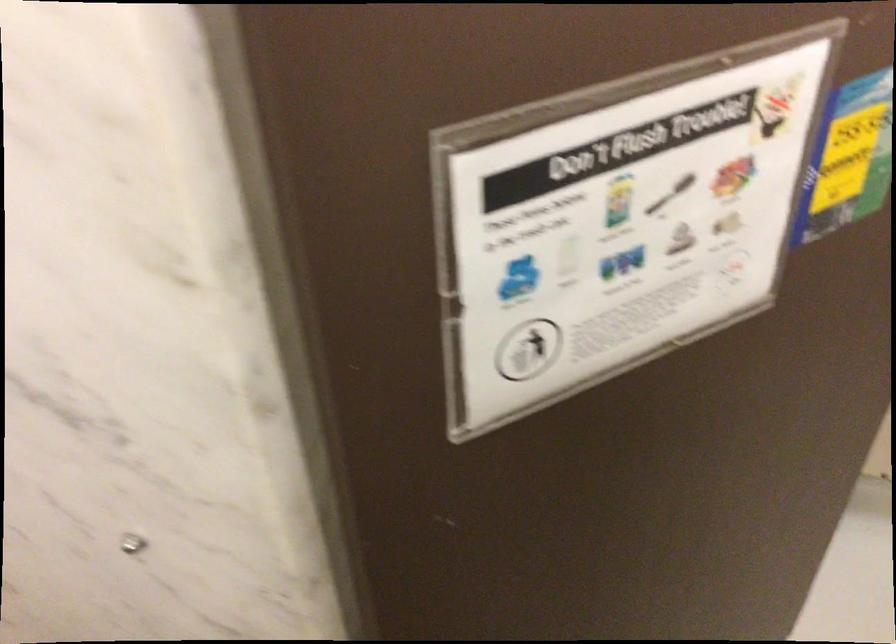
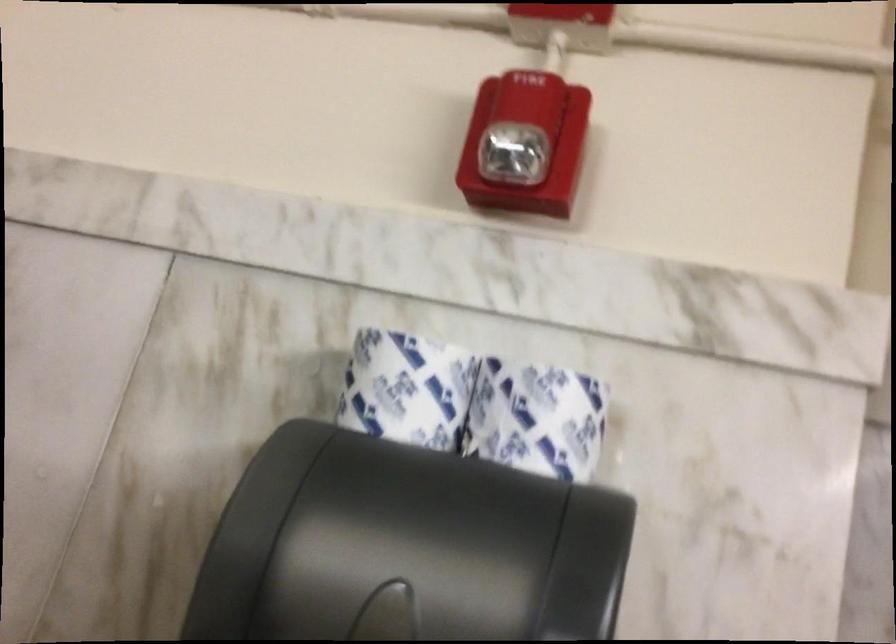
Question: The first image is from the beginning of the video and the second image is from the end. How did the camera likely rotate when shooting the video?

Choices:
 (A) Left
 (B) Right
 (C) Up
 (D) Down

Answer: (B)